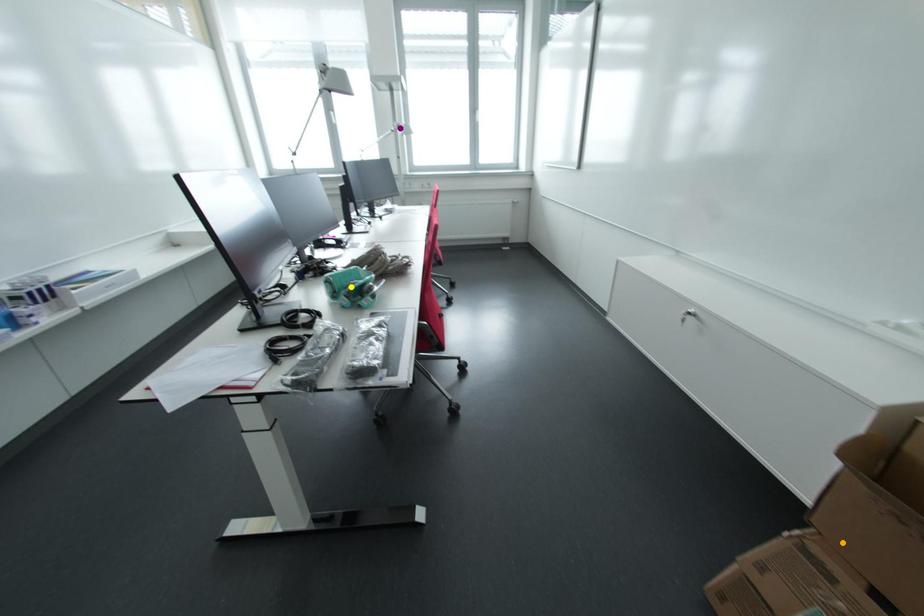
Order these from nearest to farthest:
orange point | yellow point | purple point

orange point, yellow point, purple point